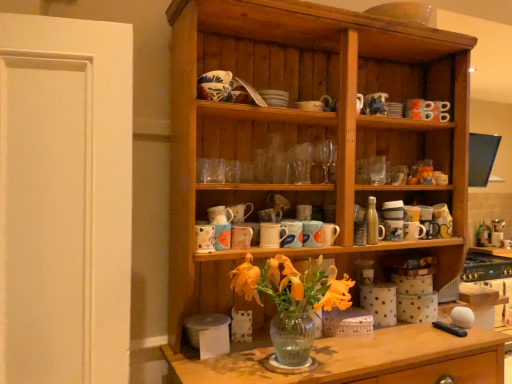
Question: Can you confirm if matte ceramic mug at center, arranged as the 2th tableware when ordered from the bottom, is taller than matte ceramic mug at center, which is the 8th tableware from top to bottom?

Choices:
 (A) no
 (B) yes

Answer: (A)

Question: Is matte ceramic mug at center, which is counted as the third tableware, starting from the left, shorter than matte ceramic mug at center, which is the 8th tableware from top to bottom?

Choices:
 (A) yes
 (B) no

Answer: (A)

Question: From the image's perspective, does matte ceramic mug at center, which is counted as the third tableware, starting from the left, appear lower than matte ceramic mug at center, which is the 8th tableware from top to bottom?

Choices:
 (A) yes
 (B) no

Answer: (B)

Question: Would you consider matte ceramic mug at center, which is the 6th tableware in right-to-left order, to be distant from matte ceramic mug at center, which is the 2th tableware from right to left?

Choices:
 (A) no
 (B) yes

Answer: (A)

Question: Does matte ceramic mug at center, which is the 6th tableware in right-to-left order, appear on the left side of matte ceramic mug at center, which is the 2th tableware from right to left?

Choices:
 (A) yes
 (B) no

Answer: (A)

Question: From a real-world perspective, is matte ceramic mug at center, which is the 6th tableware in right-to-left order, physically above matte ceramic mug at center, placed as the seventh tableware when sorted from left to right?

Choices:
 (A) no
 (B) yes

Answer: (B)

Question: Can you confirm if white matte door at left is shorter than white ceramic mug at center, which is counted as the fifth tableware, starting from the right?

Choices:
 (A) yes
 (B) no

Answer: (B)

Question: Considering the relative positions of white matte door at left and white ceramic mug at center, which ranks as the 3th tableware in top-to-bottom order, in the image provided, is white matte door at left to the left of white ceramic mug at center, which ranks as the 3th tableware in top-to-bottom order, from the viewer's perspective?

Choices:
 (A) no
 (B) yes

Answer: (B)

Question: Is white matte door at left not near white ceramic mug at center, which ranks as the 3th tableware in top-to-bottom order?

Choices:
 (A) yes
 (B) no

Answer: (B)

Question: Is white matte door at left touching white ceramic mug at center, arranged as the fourth tableware when viewed from the left?

Choices:
 (A) no
 (B) yes

Answer: (A)

Question: Is white matte door at left oriented towards white ceramic mug at center, arranged as the fourth tableware when viewed from the left?

Choices:
 (A) no
 (B) yes

Answer: (A)

Question: Does white matte door at left appear on the right side of white ceramic mug at center, which is counted as the fifth tableware, starting from the right?

Choices:
 (A) no
 (B) yes

Answer: (A)

Question: Does blue and white ceramic mug at center, the fourth tableware in the top-to-bottom sequence, appear on the left side of matte ceramic mug at center, which is the sixth tableware from top to bottom?

Choices:
 (A) no
 (B) yes

Answer: (A)